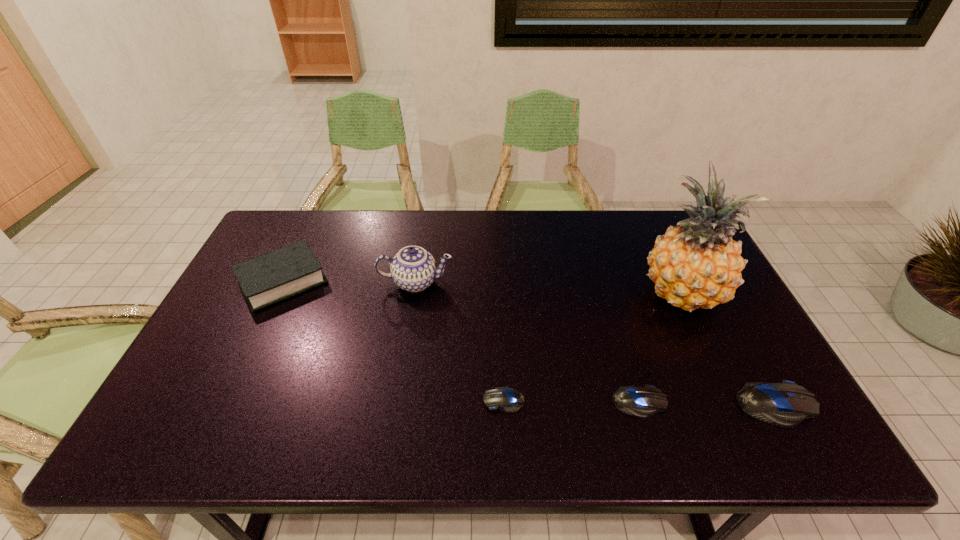
Identify the location of pineapple situated at the right edge. (697, 265).

Locate an element on the screen. Image resolution: width=960 pixels, height=540 pixels. object that is at the near right corner is located at coordinates (786, 404).

You are a GUI agent. You are given a task and a screenshot of the screen. Output one action in this format:
    pyautogui.click(x=<x>, y=<y>)
    Task: Click on the free region at the far edge
    The height and width of the screenshot is (540, 960).
    Given the screenshot: What is the action you would take?
    pyautogui.click(x=316, y=236)

Where is `free space at the near edge of the desktop`? The height and width of the screenshot is (540, 960). free space at the near edge of the desktop is located at coordinates (588, 384).

Find the location of a particular element. free region at the left edge of the desktop is located at coordinates click(267, 331).

Where is `vacant space at the far left corner of the desktop`? vacant space at the far left corner of the desktop is located at coordinates (279, 220).

The width and height of the screenshot is (960, 540). I want to click on blank space at the near left corner, so click(193, 409).

Image resolution: width=960 pixels, height=540 pixels. Identify the location of vacant space that's between the second computer mouse from right to left and the tallest object. (660, 348).

Identify the location of vacant space that's between the fifth object from right to left and the shortest object. The height and width of the screenshot is (540, 960). (460, 341).

Image resolution: width=960 pixels, height=540 pixels. In order to click on vacant area that lies between the second tallest computer mouse and the leftmost object in this screenshot , I will do `click(461, 342)`.